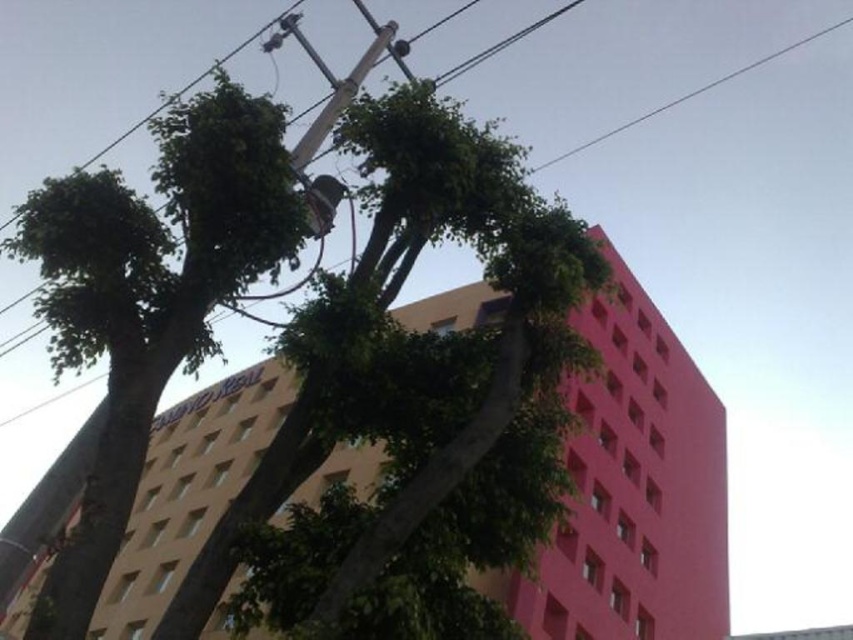
Question: Does green leafy tree at upper left appear on the right side of metallic gray power line at upper center?

Choices:
 (A) yes
 (B) no

Answer: (B)

Question: Does pink matte building at center appear on the right side of green leafy tree at upper left?

Choices:
 (A) yes
 (B) no

Answer: (A)

Question: Is green leafy tree at upper left above metallic gray power line at upper center?

Choices:
 (A) yes
 (B) no

Answer: (B)

Question: Which object appears closest to the camera in this image?

Choices:
 (A) pink matte building at center
 (B) green leafy tree at upper left
 (C) metallic gray power line at upper center
 (D) metallic gray telegraph pole at center

Answer: (B)

Question: Among these objects, which one is nearest to the camera?

Choices:
 (A) metallic gray telegraph pole at center
 (B) green leafy tree at upper left
 (C) metallic gray power line at upper center
 (D) pink matte building at center

Answer: (B)

Question: Which object is positioned farthest from the metallic gray telegraph pole at center?

Choices:
 (A) green leafy tree at upper left
 (B) pink matte building at center

Answer: (B)